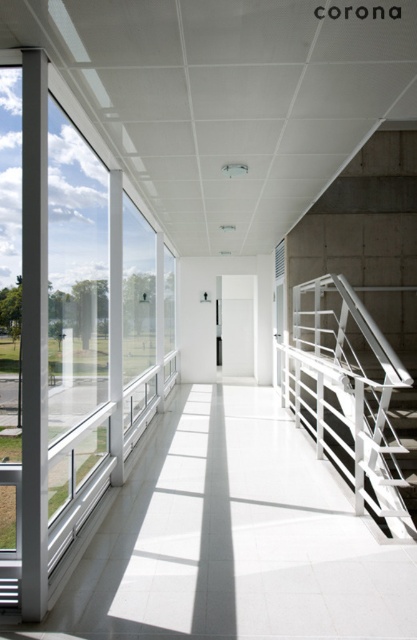
You are a maintenance worker needing to replace a damaged panel. You have a panel that is exactly the width of the white metal railing at right. Can you use this panel to replace the damaged panel of the transparent glass window at left?

The transparent glass window at left is wider than the white metal railing at right. Since the panel you have matches the railing width, it would not be wide enough to fit the window panel. You need a wider panel for the transparent glass window at left.

Looking at this image, you are a maintenance worker needing to inspect both the transparent glass window at left and the white metal railing at right. Starting from the entrance of the corridor, which object should you approach first?

You should approach the transparent glass window at left first since it is located to the left of the white metal railing at right, meaning it is positioned further to the left side of the corridor.